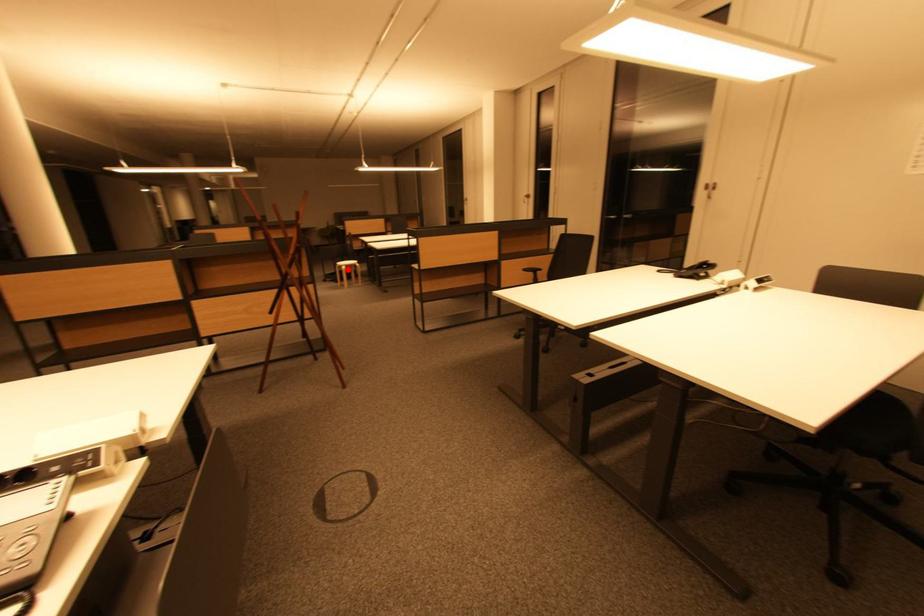
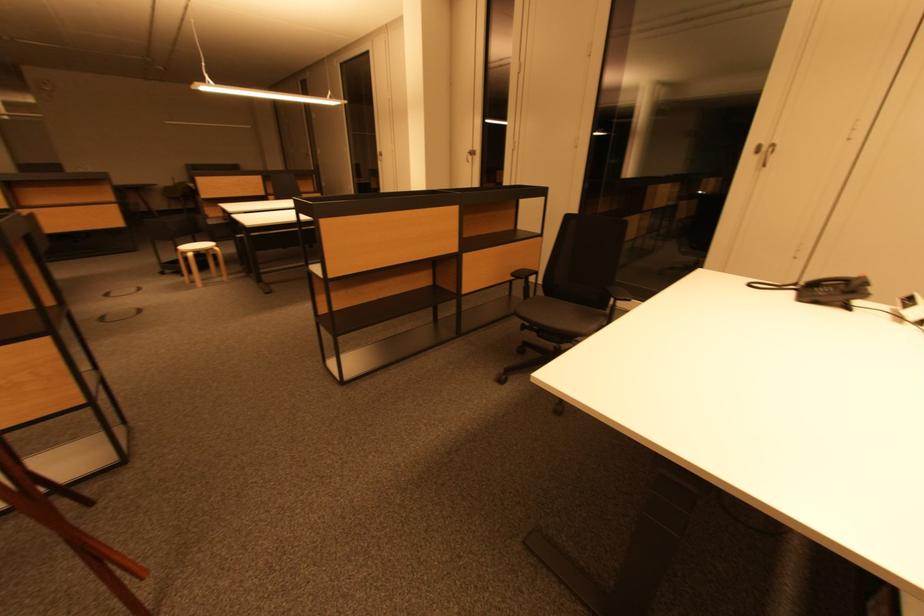
The point at the highlighted location is marked in the first image. Where is the corresponding point in the second image?

(193, 256)